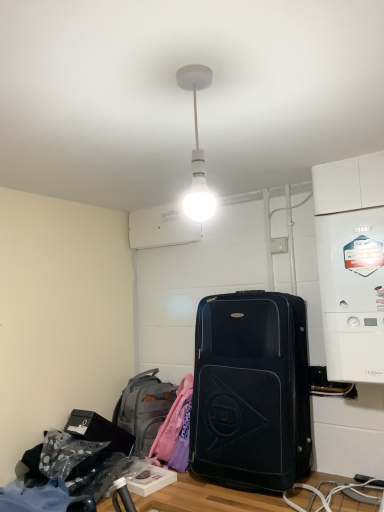
Question: Can you confirm if white plastic boiler at right is smaller than white matte bulb at center?

Choices:
 (A) no
 (B) yes

Answer: (A)

Question: Is white plastic boiler at right not inside white matte bulb at center?

Choices:
 (A) yes
 (B) no

Answer: (A)

Question: Can you confirm if white plastic boiler at right is taller than white matte bulb at center?

Choices:
 (A) yes
 (B) no

Answer: (A)

Question: Can you confirm if white plastic boiler at right is shorter than white matte bulb at center?

Choices:
 (A) yes
 (B) no

Answer: (B)

Question: Can you confirm if white plastic boiler at right is bigger than white matte bulb at center?

Choices:
 (A) yes
 (B) no

Answer: (A)

Question: Is black fabric suitcase at center wider or thinner than white matte bulb at center?

Choices:
 (A) thin
 (B) wide

Answer: (B)

Question: Visually, is black fabric suitcase at center positioned to the left or to the right of white matte bulb at center?

Choices:
 (A) right
 (B) left

Answer: (A)

Question: Does point (220, 321) appear closer or farther from the camera than point (195, 185)?

Choices:
 (A) closer
 (B) farther

Answer: (B)

Question: Which is correct: black fabric suitcase at center is inside white matte bulb at center, or outside of it?

Choices:
 (A) outside
 (B) inside

Answer: (A)

Question: Is point (192, 163) positioned closer to the camera than point (155, 376)?

Choices:
 (A) farther
 (B) closer

Answer: (B)

Question: Would you say white matte bulb at center is to the left or to the right of gray fabric backpack at lower left in the picture?

Choices:
 (A) right
 (B) left

Answer: (A)

Question: Based on their sizes in the image, would you say white matte bulb at center is bigger or smaller than gray fabric backpack at lower left?

Choices:
 (A) big
 (B) small

Answer: (B)

Question: Looking at their shapes, would you say white matte bulb at center is wider or thinner than gray fabric backpack at lower left?

Choices:
 (A) wide
 (B) thin

Answer: (B)

Question: Is white plastic boiler at right in front of or behind black fabric suitcase at center in the image?

Choices:
 (A) behind
 (B) front

Answer: (B)

Question: In terms of height, does white plastic boiler at right look taller or shorter compared to black fabric suitcase at center?

Choices:
 (A) short
 (B) tall

Answer: (B)